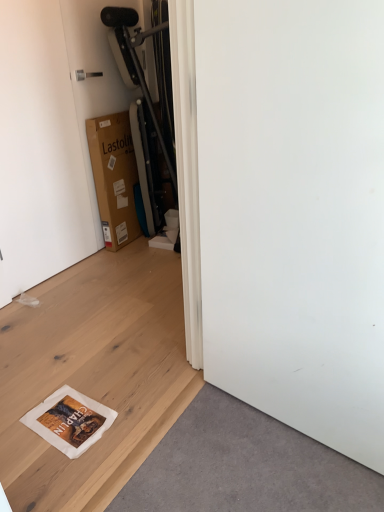
Question: Should I look upward or downward to see white matte plywood at lower left?

Choices:
 (A) up
 (B) down

Answer: (B)

Question: From a real-world perspective, is white matte door at upper left positioned over white matte plywood at lower left based on gravity?

Choices:
 (A) no
 (B) yes

Answer: (B)

Question: Is white matte door at upper left oriented away from white matte plywood at lower left?

Choices:
 (A) yes
 (B) no

Answer: (B)

Question: Is white matte door at upper left surrounding white matte plywood at lower left?

Choices:
 (A) no
 (B) yes

Answer: (A)

Question: Is white matte door at upper left positioned in front of white matte plywood at lower left?

Choices:
 (A) yes
 (B) no

Answer: (B)

Question: Can you confirm if white matte door at upper left is wider than white matte plywood at lower left?

Choices:
 (A) yes
 (B) no

Answer: (B)

Question: From the image's perspective, is white matte door at upper left located beneath white matte plywood at lower left?

Choices:
 (A) yes
 (B) no

Answer: (B)

Question: Is white matte screen door at lower right to the left of white matte plywood at lower left from the viewer's perspective?

Choices:
 (A) yes
 (B) no

Answer: (B)

Question: Does white matte screen door at lower right have a smaller size compared to white matte plywood at lower left?

Choices:
 (A) yes
 (B) no

Answer: (B)

Question: Can you confirm if white matte screen door at lower right is positioned to the right of white matte plywood at lower left?

Choices:
 (A) yes
 (B) no

Answer: (A)

Question: Considering the relative positions of white matte screen door at lower right and white matte plywood at lower left in the image provided, is white matte screen door at lower right behind white matte plywood at lower left?

Choices:
 (A) no
 (B) yes

Answer: (A)

Question: From the image's perspective, is white matte screen door at lower right on top of white matte plywood at lower left?

Choices:
 (A) no
 (B) yes

Answer: (B)

Question: From a real-world perspective, is white matte screen door at lower right positioned over white matte plywood at lower left based on gravity?

Choices:
 (A) yes
 (B) no

Answer: (A)

Question: Are white matte door at upper left and white matte screen door at lower right located far from each other?

Choices:
 (A) no
 (B) yes

Answer: (B)